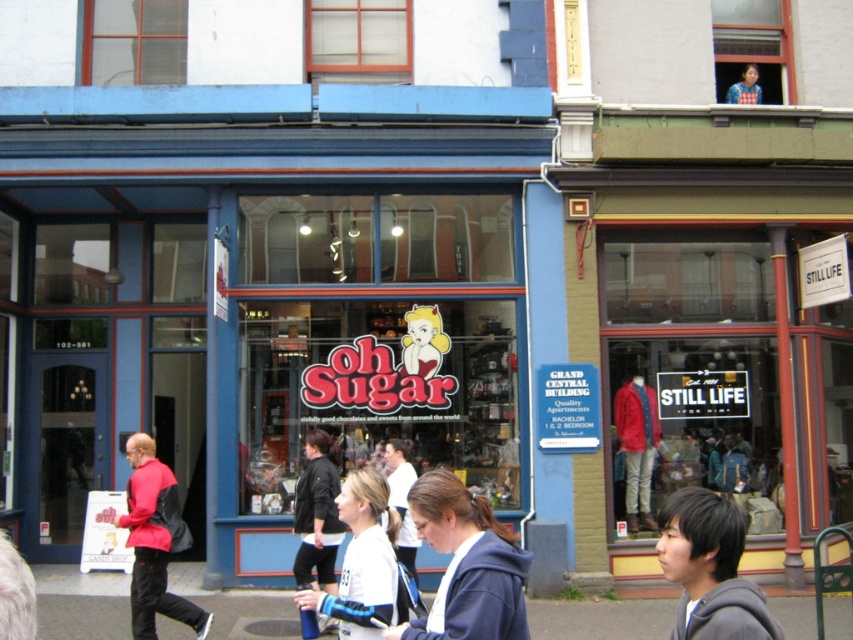
Can you confirm if matte blue storefront at center is smaller than red matte jacket at lower left?

Yes, matte blue storefront at center is smaller than red matte jacket at lower left.

Is matte blue storefront at center further to camera compared to red matte jacket at lower left?

That is True.

Is point (341, 186) behind point (138, 632)?

Yes, it is.

At what (x,y) coordinates should I click in order to perform the action: click on matte blue storefront at center. Please return your answer as a coordinate pair (x, y). Image resolution: width=853 pixels, height=640 pixels. Looking at the image, I should click on (264, 285).

Which is above, matte blue storefront at center or gray fleece jacket at lower right?

matte blue storefront at center

Is matte blue storefront at center below gray fleece jacket at lower right?

Actually, matte blue storefront at center is above gray fleece jacket at lower right.

Who is more forward, (389,109) or (706,588)?

Point (706,588) is more forward.

Locate an element on the screen. This screenshot has height=640, width=853. matte blue storefront at center is located at coordinates (264, 285).

Can you confirm if gray fleece jacket at lower right is wider than white matte jacket at center?

No.

Between gray fleece jacket at lower right and white matte jacket at center, which one appears on the right side from the viewer's perspective?

Positioned to the right is gray fleece jacket at lower right.

What do you see at coordinates (711, 570) in the screenshot? I see `gray fleece jacket at lower right` at bounding box center [711, 570].

At what (x,y) coordinates should I click in order to perform the action: click on gray fleece jacket at lower right. Please return your answer as a coordinate pair (x, y). Looking at the image, I should click on (711, 570).